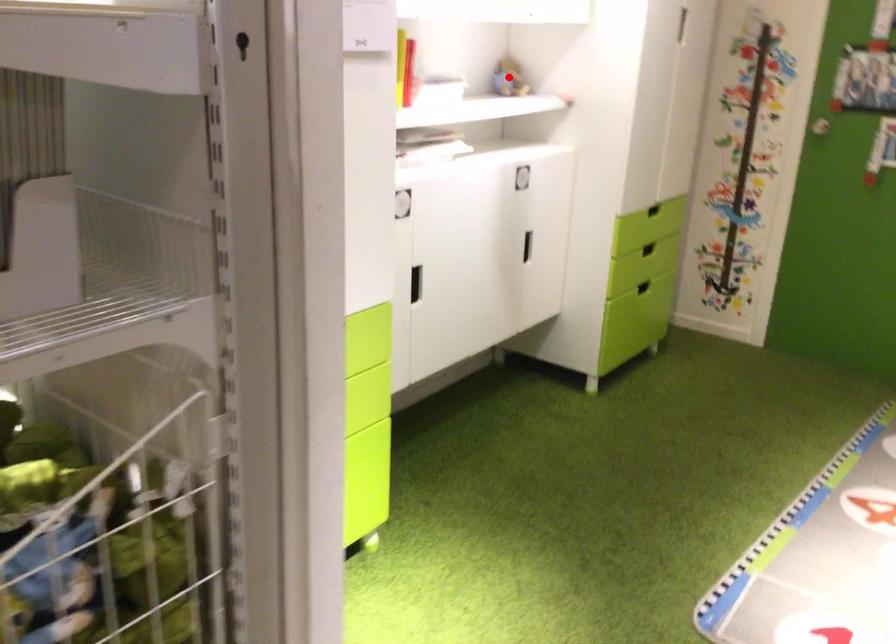
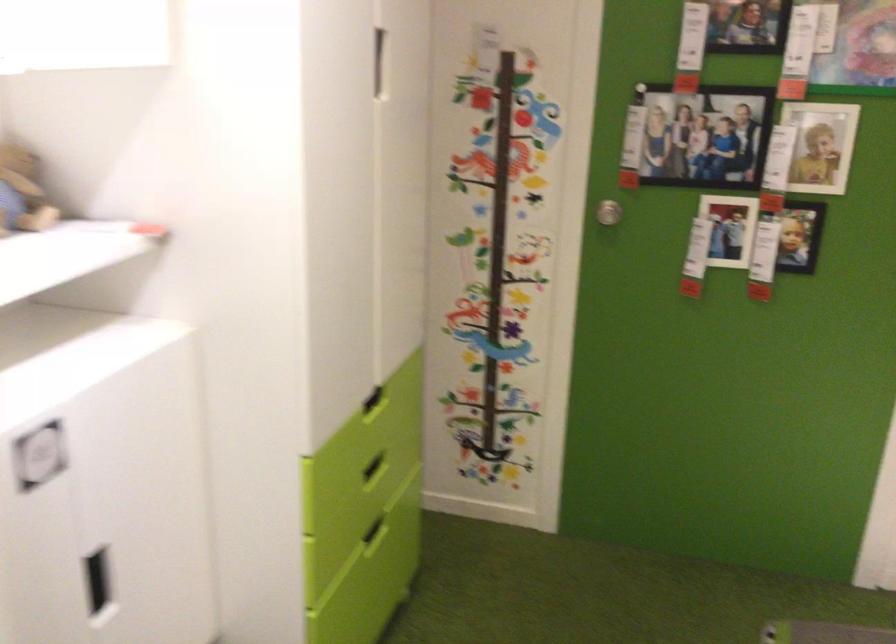
Question: I am providing you with two images of the same scene from different viewpoints. Image1 has a red point marked. In image2, the corresponding 3D location appears at what relative position? Reply with the corresponding letter.

Choices:
 (A) Closer
 (B) Farther

Answer: (A)